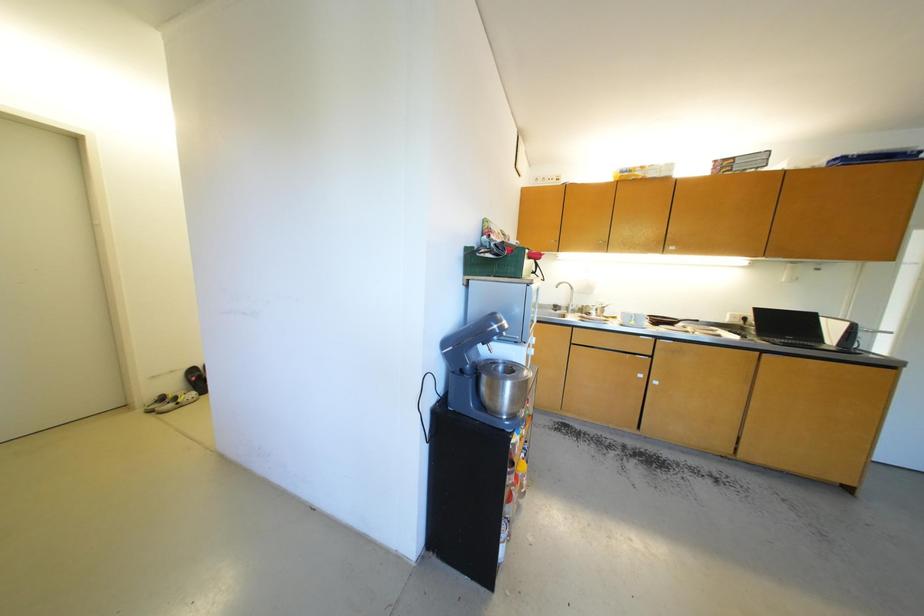
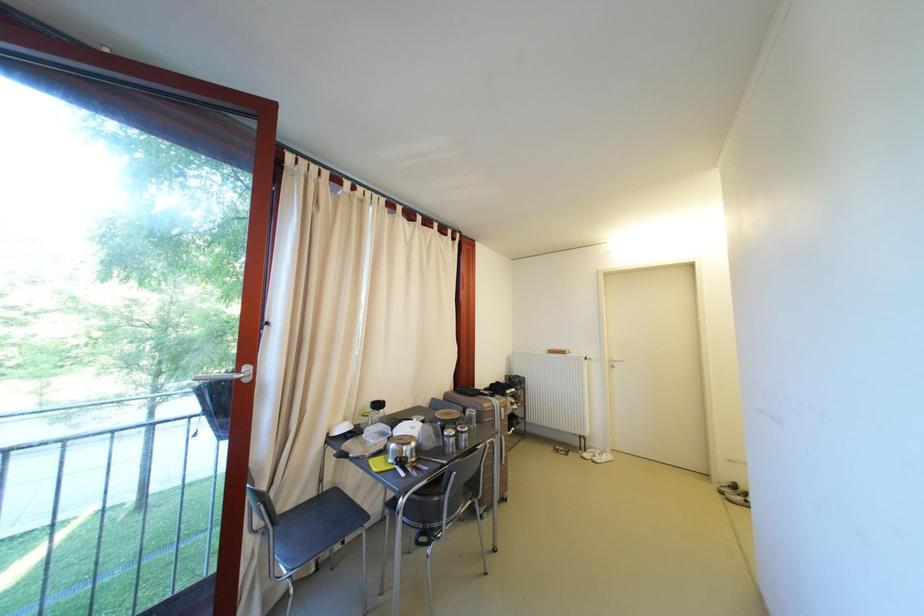
Question: How did the camera likely rotate?

Choices:
 (A) Left
 (B) Right
 (C) Up
 (D) Down

Answer: (A)